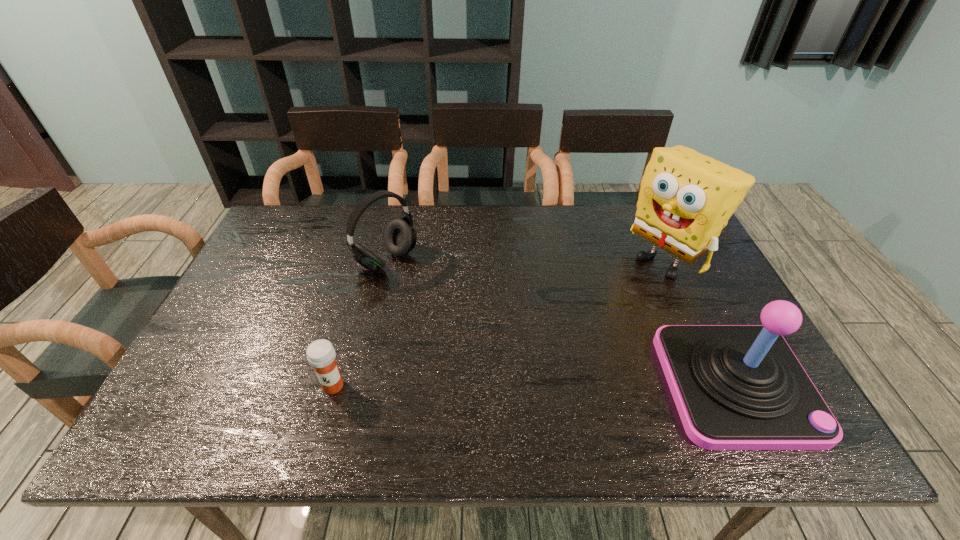
You are a GUI agent. You are given a task and a screenshot of the screen. Output one action in this format:
    pyautogui.click(x=<x>, y=<y>)
    Task: Click on the free space at the left edge
    Image resolution: width=960 pixels, height=540 pixels.
    Given the screenshot: What is the action you would take?
    pyautogui.click(x=243, y=328)

Identify the location of free region at the right edge. (699, 298).

Find the location of a particular element. This screenshot has height=540, width=960. free spot at the far left corner of the desktop is located at coordinates (307, 221).

Locate an element on the screen. free area in between the medicine and the headset is located at coordinates (360, 323).

The height and width of the screenshot is (540, 960). Identify the location of free space between the joystick and the headset. (561, 323).

Find the location of a particular element. The width and height of the screenshot is (960, 540). free spot between the joystick and the headset is located at coordinates pos(561,323).

You are a GUI agent. You are given a task and a screenshot of the screen. Output one action in this format:
    pyautogui.click(x=<x>, y=<y>)
    Task: Click on the blank region between the headset and the joystick
    This screenshot has width=960, height=540.
    Given the screenshot: What is the action you would take?
    pyautogui.click(x=561, y=323)

You are a GUI agent. You are given a task and a screenshot of the screen. Output one action in this format:
    pyautogui.click(x=<x>, y=<y>)
    Task: Click on the free space that is in between the headset and the sponge
    The width and height of the screenshot is (960, 540).
    Given the screenshot: What is the action you would take?
    pyautogui.click(x=526, y=260)

At what (x,y) coordinates should I click in order to perform the action: click on free space between the headset and the joystick. Please return your answer as a coordinate pair (x, y). This screenshot has width=960, height=540. Looking at the image, I should click on (561, 323).

Image resolution: width=960 pixels, height=540 pixels. What are the coordinates of `blank region between the joystick and the headset` in the screenshot? It's located at (561, 323).